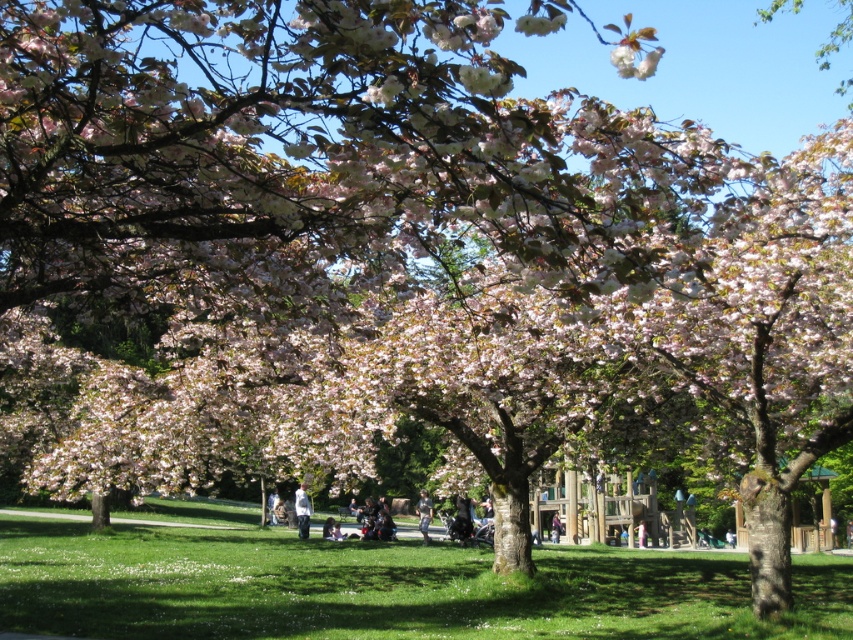
Question: Can you confirm if green grass at center is positioned above white cotton shirt at center?

Choices:
 (A) yes
 (B) no

Answer: (A)

Question: Which of the following is the farthest from the observer?

Choices:
 (A) (427, 502)
 (B) (195, 502)
 (C) (552, 538)
 (D) (303, 531)

Answer: (B)

Question: Where is green grass at center located in relation to white cotton shirt at center in the image?

Choices:
 (A) below
 (B) above

Answer: (B)

Question: Estimate the real-world distances between objects in this image. Which object is closer to the denim jacket at center?

Choices:
 (A) green grass at center
 (B) white cotton shirt at center
 (C) dark blue jeans at center

Answer: (B)

Question: Which point appears closest to the camera in this image?

Choices:
 (A) (109, 600)
 (B) (555, 538)

Answer: (A)

Question: Does green grass at center have a larger size compared to white cotton shirt at center?

Choices:
 (A) yes
 (B) no

Answer: (A)